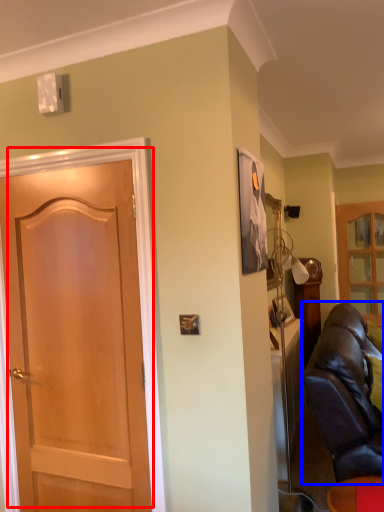
Question: Which object is closer to the camera taking this photo, door (highlighted by a red box) or studio couch (highlighted by a blue box)?

Choices:
 (A) door
 (B) studio couch

Answer: (A)